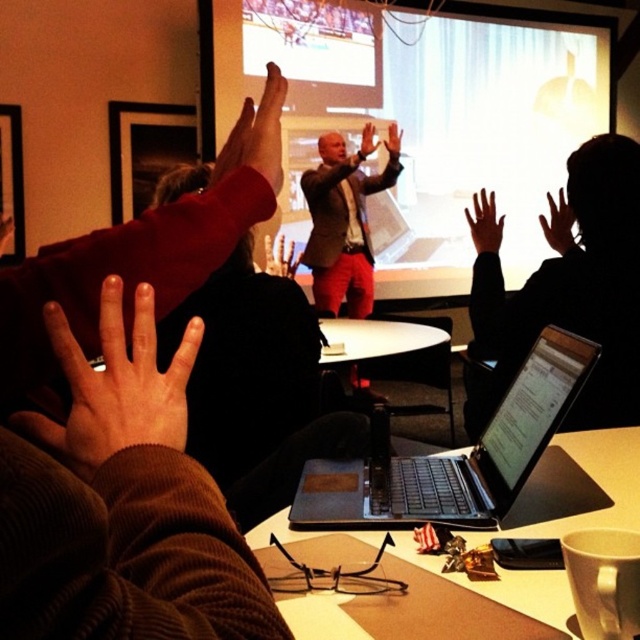
Question: Which is nearer to the dark matte hand at upper right?

Choices:
 (A) matte black laptop at center
 (B) matte white projector screen at center

Answer: (A)

Question: Is brown leather hand at upper left smaller than matte black hand at upper center?

Choices:
 (A) yes
 (B) no

Answer: (A)

Question: Is matte white projector screen at center bigger than brown leather hand at upper center?

Choices:
 (A) no
 (B) yes

Answer: (B)

Question: Which of the following is the closest to the observer?

Choices:
 (A) (461, 96)
 (B) (488, 488)
 (C) (474, 228)

Answer: (B)

Question: Is black matte laptop at upper center wider than white matte table at center?

Choices:
 (A) no
 (B) yes

Answer: (A)

Question: Which object is the farthest from the matte black hand at upper center?

Choices:
 (A) brown leather hand at center
 (B) smooth skin hand at upper center
 (C) black matte laptop at upper center

Answer: (C)